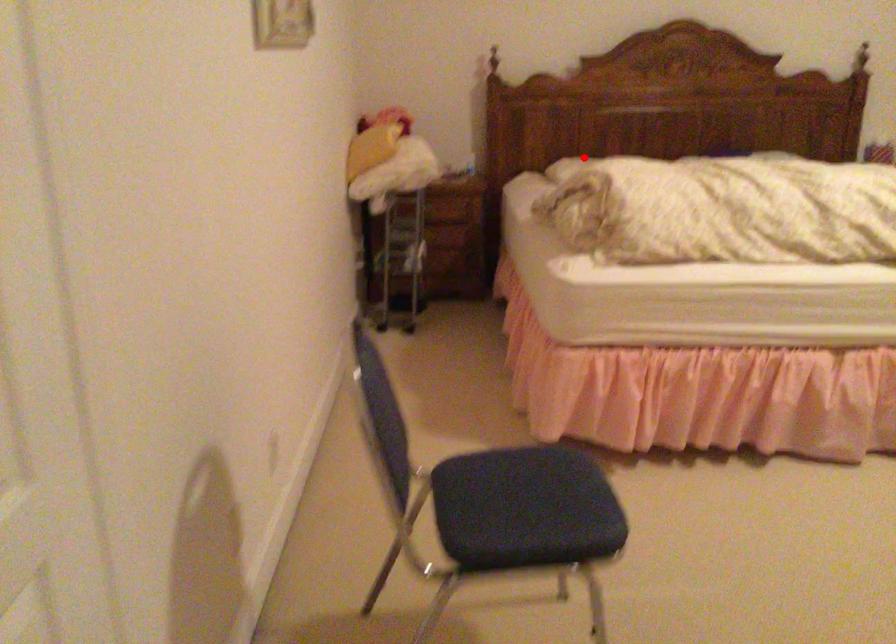
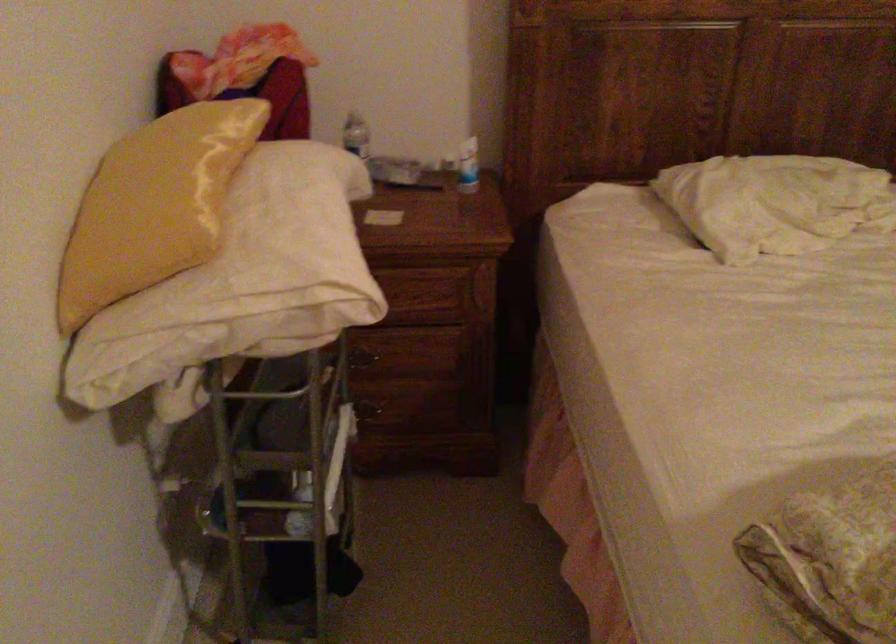
Where in the second image is the point corresponding to the highlighted location from the first image?

(774, 202)